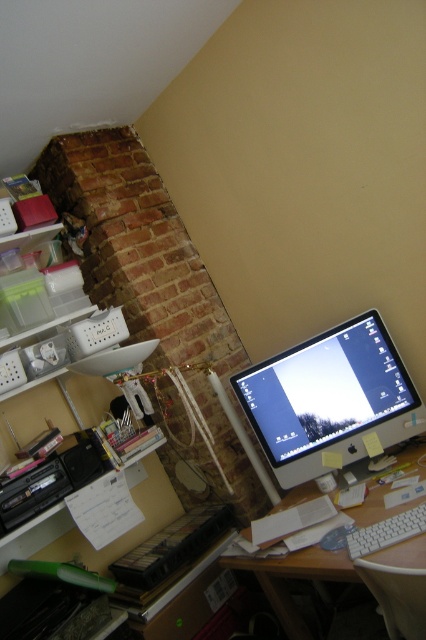
Is white plastic computer desk at center positioned behind white plastic keyboard at lower right?

No, it is in front of white plastic keyboard at lower right.

The height and width of the screenshot is (640, 426). Describe the element at coordinates (294, 579) in the screenshot. I see `white plastic computer desk at center` at that location.

The height and width of the screenshot is (640, 426). Identify the location of white plastic computer desk at center. (294, 579).

Can you confirm if satin silver monitor at center is positioned above white plastic keyboard at lower right?

Indeed, satin silver monitor at center is positioned over white plastic keyboard at lower right.

Can you confirm if satin silver monitor at center is wider than white plastic keyboard at lower right?

Indeed, satin silver monitor at center has a greater width compared to white plastic keyboard at lower right.

Between point (365, 408) and point (382, 545), which one is positioned behind?

Point (365, 408)

In order to click on satin silver monitor at center in this screenshot , I will do `click(330, 397)`.

How far apart are satin silver monitor at center and white plastic computer desk at center?

A distance of 11.85 inches exists between satin silver monitor at center and white plastic computer desk at center.

Between satin silver monitor at center and white plastic computer desk at center, which one is positioned lower?

white plastic computer desk at center is below.

What are the coordinates of `satin silver monitor at center` in the screenshot? It's located at (330, 397).